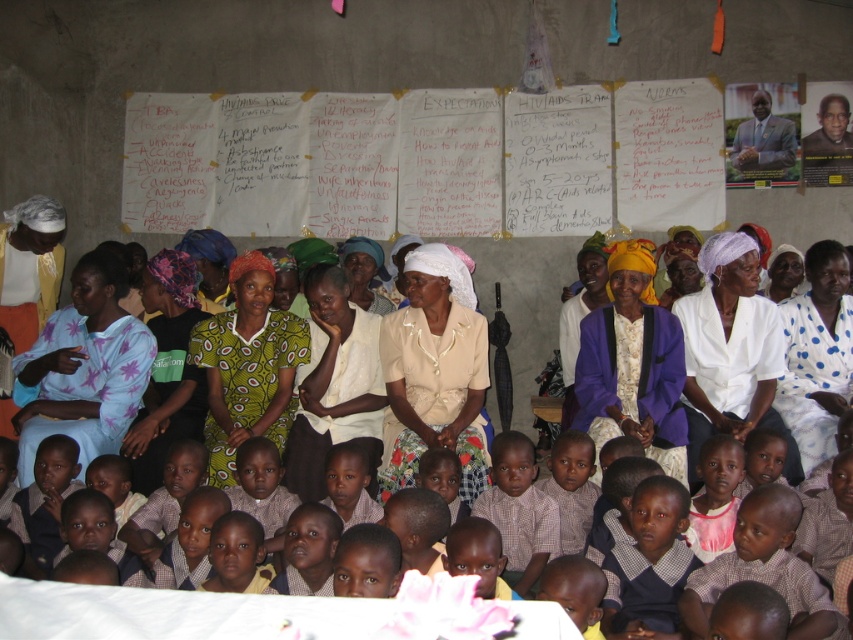
Can you confirm if matte yellow shirt at center is positioned below plaid shirt at center?

Actually, matte yellow shirt at center is above plaid shirt at center.

Is matte yellow shirt at center closer to camera compared to plaid shirt at center?

No, matte yellow shirt at center is further to the viewer.

Locate an element on the screen. matte yellow shirt at center is located at coordinates (332, 380).

Is point (621, 218) farther from viewer compared to point (508, 525)?

Yes, it is.

This screenshot has width=853, height=640. Find the location of `white paper at upper center`. white paper at upper center is located at coordinates pyautogui.click(x=426, y=161).

Is purple printed shirt at center to the right of plaid shirt at center from the viewer's perspective?

No, purple printed shirt at center is not to the right of plaid shirt at center.

How distant is purple printed shirt at center from plaid shirt at center?

purple printed shirt at center and plaid shirt at center are 2.50 meters apart.

Between point (79, 305) and point (537, 524), which one is positioned in front?

Point (537, 524) is in front.

At what (x,y) coordinates should I click in order to perform the action: click on purple printed shirt at center. Please return your answer as a coordinate pair (x, y). Looking at the image, I should click on (84, 368).